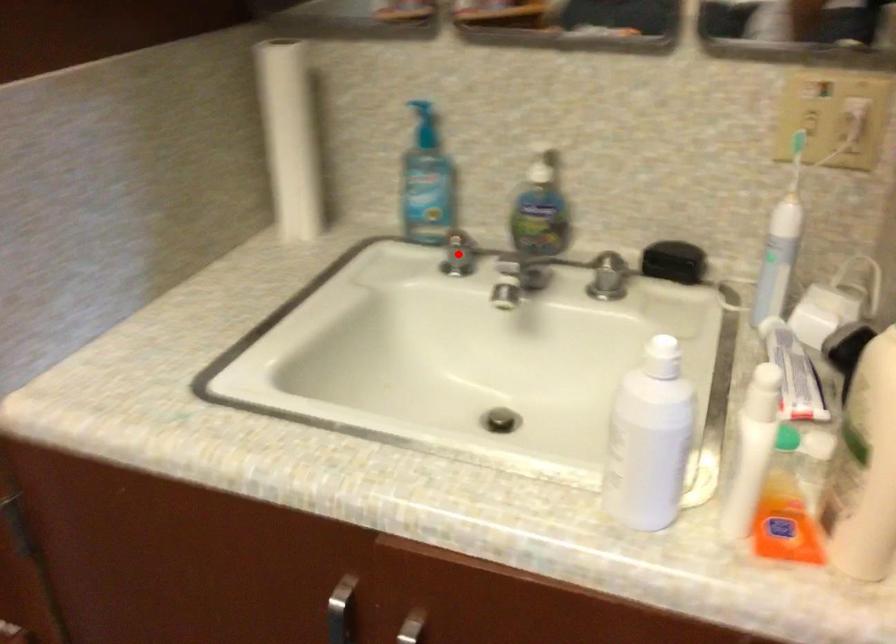
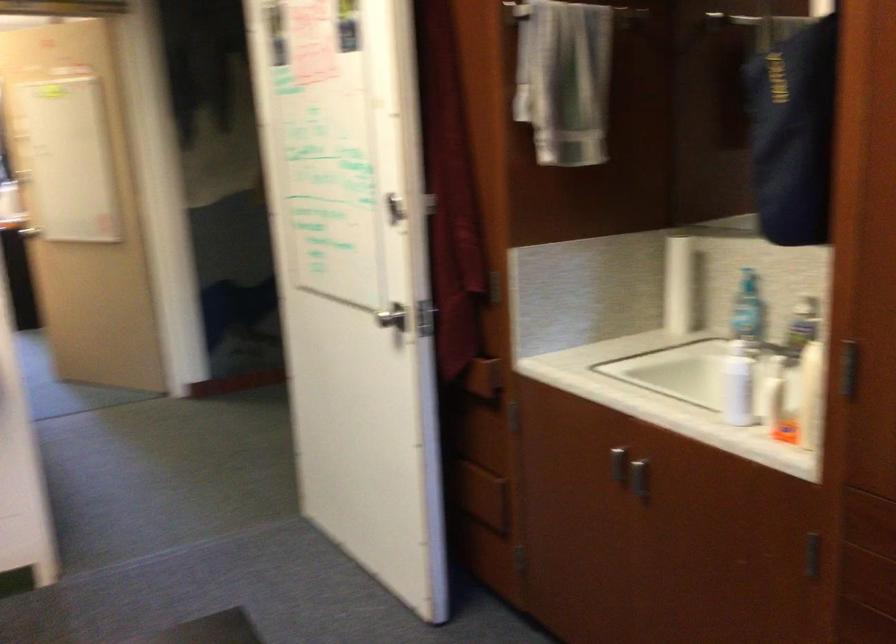
Question: I am providing you with two images of the same scene from different viewpoints. A red point is marked on the first image. Can you still see the location of the red point in image 2?

Choices:
 (A) Yes
 (B) No

Answer: (B)